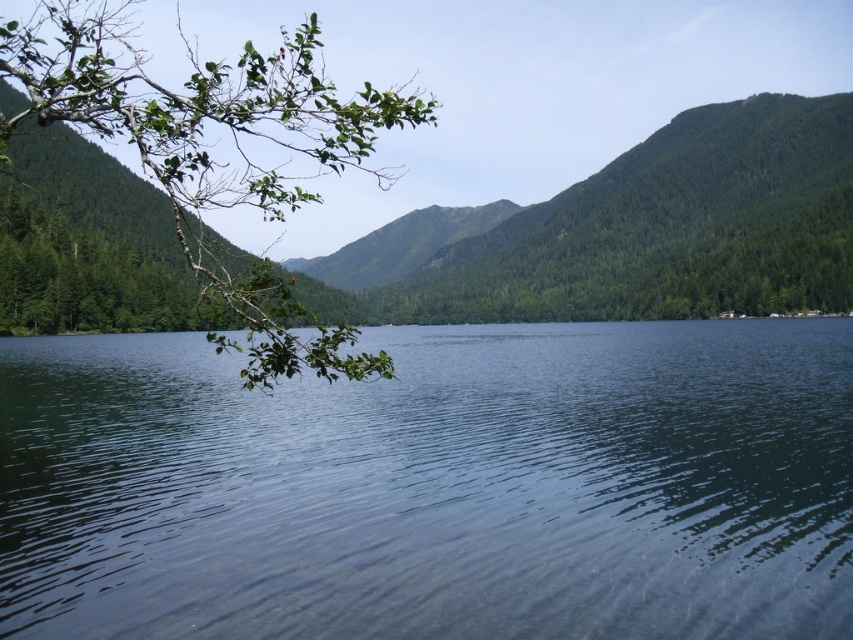
From the picture: You are standing at the edge of the lake and notice the clear water at center and the green leafy branch at upper left. Which object is closer to the horizon?

The green leafy branch at upper left is closer to the horizon than the clear water at center because the clear water at center has a lesser height compared to green leafy branch at upper left.